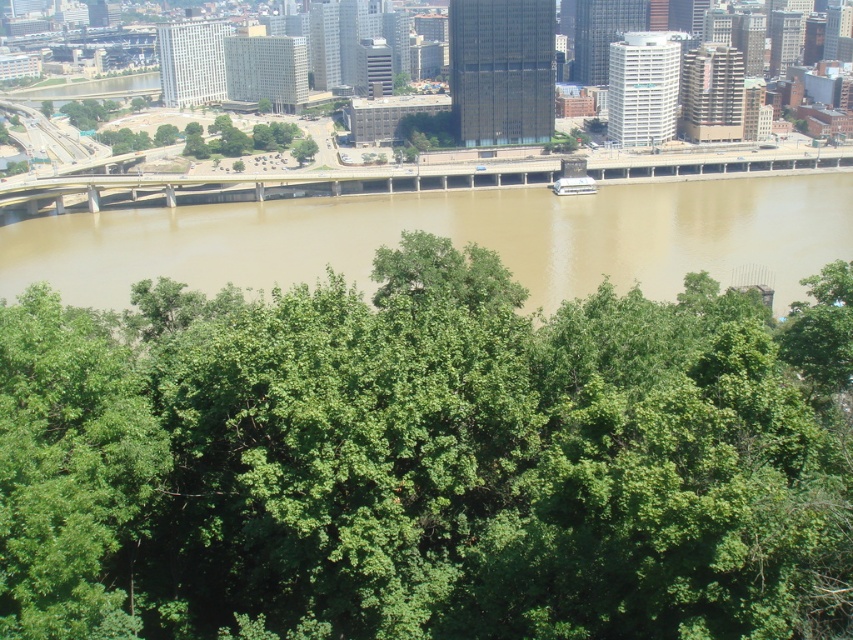
Question: Is green leafy tree at center behind brown concrete bridge at center?

Choices:
 (A) no
 (B) yes

Answer: (A)

Question: Which point is farther to the camera?

Choices:
 (A) (670, 276)
 (B) (132, 182)

Answer: (B)

Question: Can you confirm if brown muddy water at center is positioned above brown concrete bridge at center?

Choices:
 (A) yes
 (B) no

Answer: (B)

Question: Does brown muddy water at center appear on the left side of brown concrete bridge at center?

Choices:
 (A) no
 (B) yes

Answer: (A)

Question: Which object is positioned farthest from the green leafy tree at center?

Choices:
 (A) brown muddy water at center
 (B) brown concrete bridge at center

Answer: (B)

Question: Among these points, which one is nearest to the camera?

Choices:
 (A) (173, 621)
 (B) (180, 248)

Answer: (A)